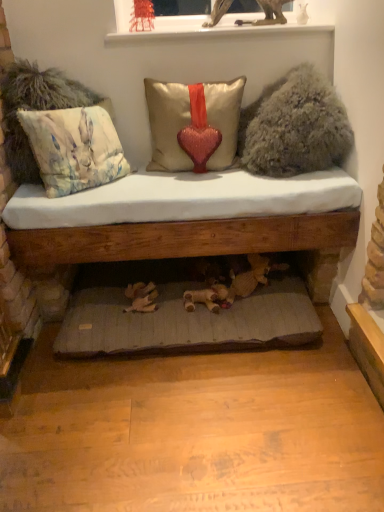
Question: Considering the relative positions of wooden cushioned bench at center and white glossy window sill at upper center in the image provided, is wooden cushioned bench at center to the left of white glossy window sill at upper center from the viewer's perspective?

Choices:
 (A) no
 (B) yes

Answer: (B)

Question: From the image's perspective, is wooden cushioned bench at center on white glossy window sill at upper center?

Choices:
 (A) yes
 (B) no

Answer: (B)

Question: From a real-world perspective, is wooden cushioned bench at center over white glossy window sill at upper center?

Choices:
 (A) no
 (B) yes

Answer: (A)

Question: Can you confirm if wooden cushioned bench at center is positioned to the right of white glossy window sill at upper center?

Choices:
 (A) yes
 (B) no

Answer: (B)

Question: Could you tell me if wooden cushioned bench at center is turned towards white glossy window sill at upper center?

Choices:
 (A) yes
 (B) no

Answer: (B)

Question: Is wooden cushioned bench at center looking in the opposite direction of white glossy window sill at upper center?

Choices:
 (A) yes
 (B) no

Answer: (B)

Question: From a real-world perspective, is satin/velvet pillow with heart at center, which is the first pillow in right-to-left order, located beneath fuzzy beige pillow at upper right?

Choices:
 (A) no
 (B) yes

Answer: (B)

Question: Is satin/velvet pillow with heart at center, which is the first pillow in right-to-left order, surrounding fuzzy beige pillow at upper right?

Choices:
 (A) no
 (B) yes

Answer: (A)

Question: From the image's perspective, does satin/velvet pillow with heart at center, which is the first pillow in right-to-left order, appear lower than fuzzy beige pillow at upper right?

Choices:
 (A) yes
 (B) no

Answer: (A)

Question: Is satin/velvet pillow with heart at center, which is the first pillow in right-to-left order, at the right side of fuzzy beige pillow at upper right?

Choices:
 (A) yes
 (B) no

Answer: (B)

Question: Is satin/velvet pillow with heart at center, which is the first pillow in right-to-left order, wider than fuzzy beige pillow at upper right?

Choices:
 (A) yes
 (B) no

Answer: (B)

Question: From the image's perspective, is wooden bed frame at lower center above gray fabric cushion at lower center?

Choices:
 (A) no
 (B) yes

Answer: (B)